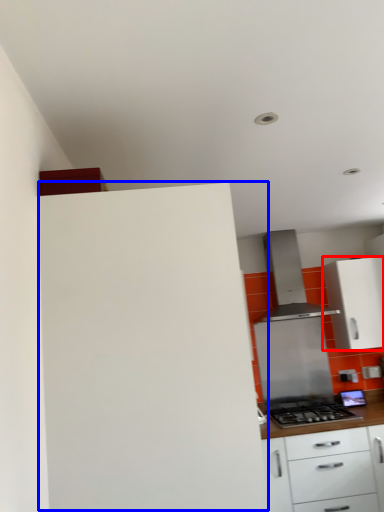
Question: Which point is further to the camera, cabinetry (highlighted by a red box) or cabinetry (highlighted by a blue box)?

Choices:
 (A) cabinetry
 (B) cabinetry

Answer: (A)